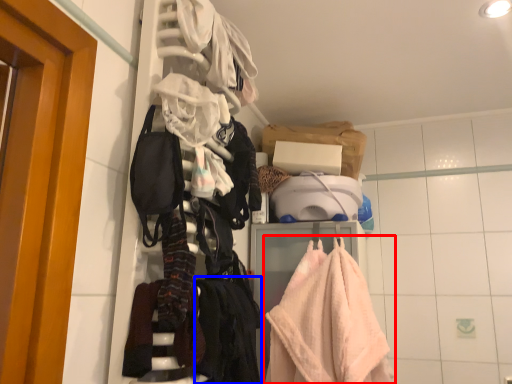
Question: Which object is closer to the camera taking this photo, towel (highlighted by a red box) or clothing (highlighted by a blue box)?

Choices:
 (A) towel
 (B) clothing

Answer: (B)